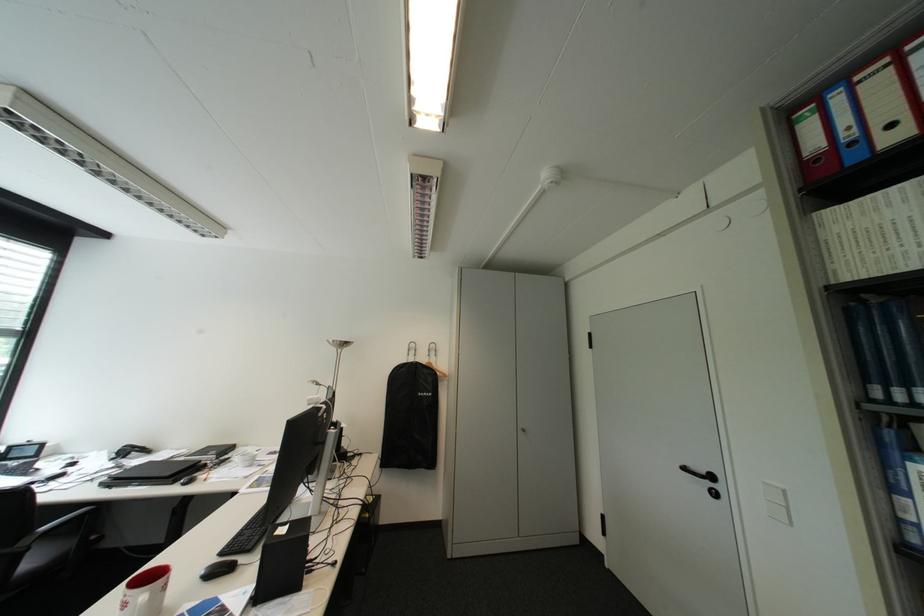
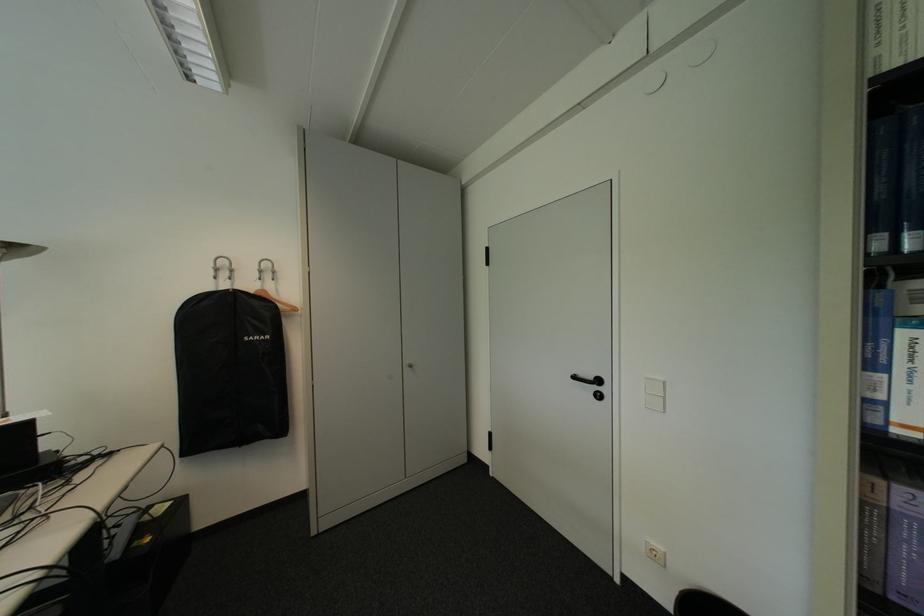
Question: The images are taken continuously from a first-person perspective. In which direction are you moving?

Choices:
 (A) Left
 (B) Right
 (C) Forward
 (D) Backward

Answer: (C)